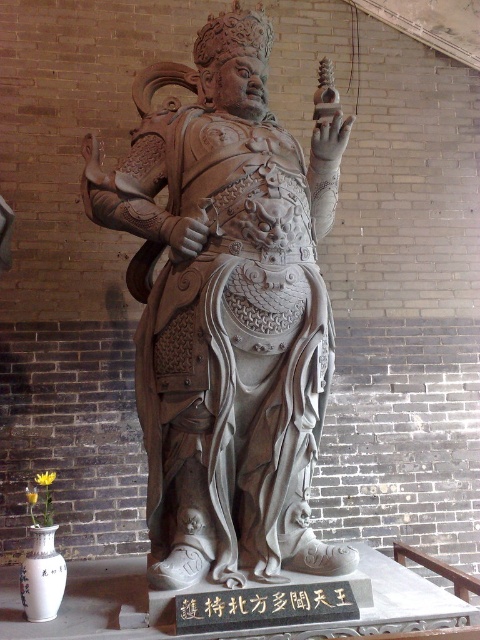
Is point (163, 544) in front of point (201, 608)?

No.

Between gray stone statue at center and black stone text at center, which one is positioned lower?

Positioned lower is black stone text at center.

This screenshot has width=480, height=640. Describe the element at coordinates (228, 308) in the screenshot. I see `gray stone statue at center` at that location.

Find the location of a particular element. gray stone statue at center is located at coordinates (228, 308).